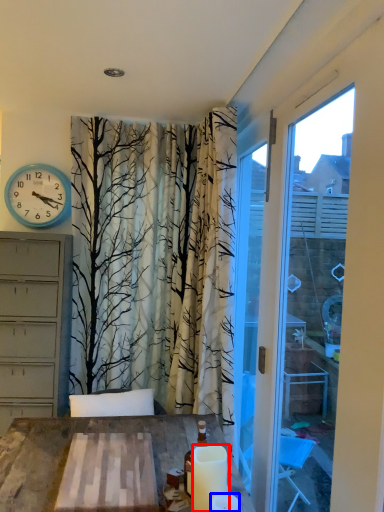
Question: Which object is further to the camera taking this photo, candle (highlighted by a red box) or candle (highlighted by a blue box)?

Choices:
 (A) candle
 (B) candle

Answer: (A)